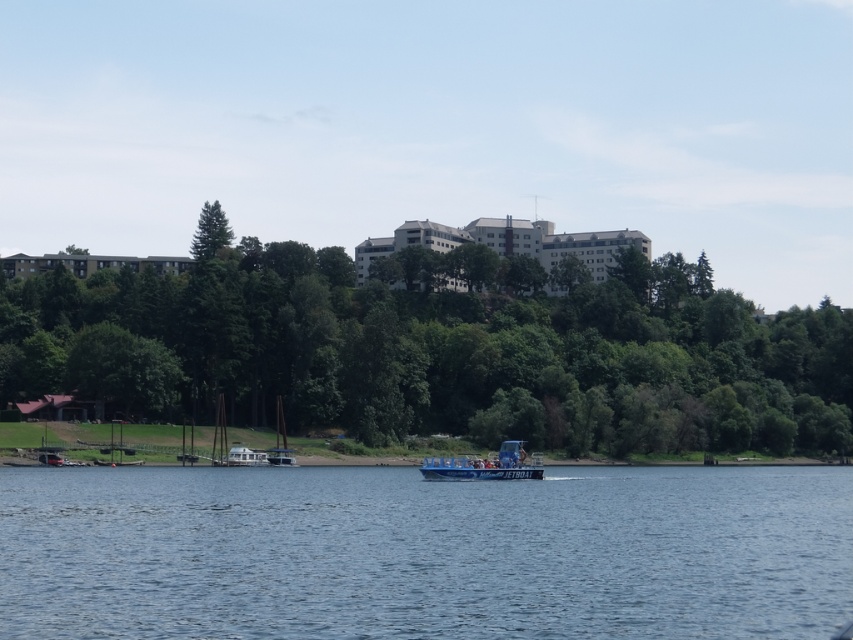
Is point (502, 442) farther from viewer compared to point (210, 220)?

No, it is not.

Between blue plastic boat at center and green matte tree at upper left, which one has less height?

Standing shorter between the two is blue plastic boat at center.

Who is more forward, (444, 465) or (194, 257)?

Point (444, 465) is in front.

At what (x,y) coordinates should I click in order to perform the action: click on blue plastic boat at center. Please return your answer as a coordinate pair (x, y). The width and height of the screenshot is (853, 640). Looking at the image, I should click on (485, 465).

Between green leafy tree at center and green matte tree at upper left, which one is positioned lower?

Positioned lower is green leafy tree at center.

Is point (370, 352) positioned behind point (209, 244)?

That is False.

The height and width of the screenshot is (640, 853). I want to click on green leafy tree at center, so click(439, 349).

Where is `blue water at center`? Image resolution: width=853 pixels, height=640 pixels. blue water at center is located at coordinates (424, 552).

Does blue water at center have a lesser width compared to white plastic houseboat at lower center?

Incorrect, blue water at center's width is not less than white plastic houseboat at lower center's.

Who is more forward, (27, 632) or (247, 458)?

Point (27, 632)

The width and height of the screenshot is (853, 640). In order to click on blue water at center in this screenshot , I will do (424, 552).